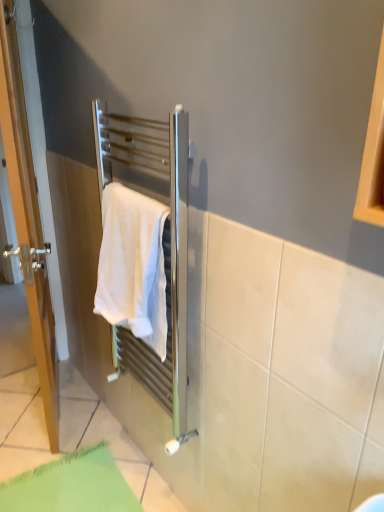
I want to click on white soft towel at center, so click(x=133, y=265).

Describe the element at coordinates (133, 265) in the screenshot. This screenshot has height=512, width=384. I see `white soft towel at center` at that location.

Locate an element on the screen. The width and height of the screenshot is (384, 512). white soft towel at center is located at coordinates (133, 265).